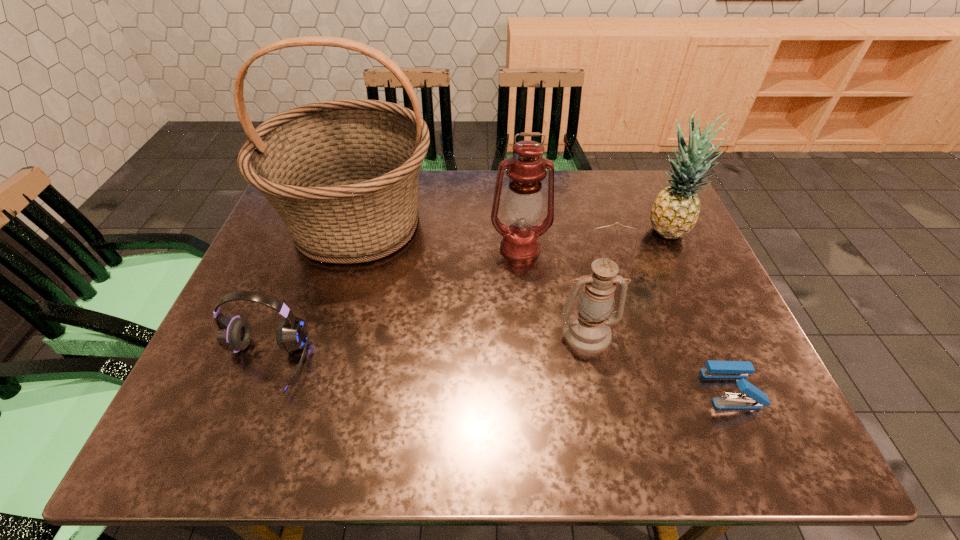
Find the location of a particular element. Image resolution: width=960 pixels, height=540 pixels. vacant space that's between the nearer oil lamp and the stapler is located at coordinates (660, 361).

Locate an element on the screen. Image resolution: width=960 pixels, height=540 pixels. vacant space that is in between the shortest object and the nearer oil lamp is located at coordinates (660, 361).

Where is `object identified as the second closest to the second shortest object`? The width and height of the screenshot is (960, 540). object identified as the second closest to the second shortest object is located at coordinates (523, 204).

Select which object is the fifth closest to the farther oil lamp. Please provide its 2D coordinates. Your answer should be formatted as a tuple, i.e. [(x, y)], where the tuple contains the x and y coordinates of a point satisfying the conditions above.

[(234, 334)]

Where is `free location that satisfies the following two spatial constraints: 1. on the ear cushions of the shortest object; 2. on the right side of the fifth tallest object`? The height and width of the screenshot is (540, 960). free location that satisfies the following two spatial constraints: 1. on the ear cushions of the shortest object; 2. on the right side of the fifth tallest object is located at coordinates (254, 389).